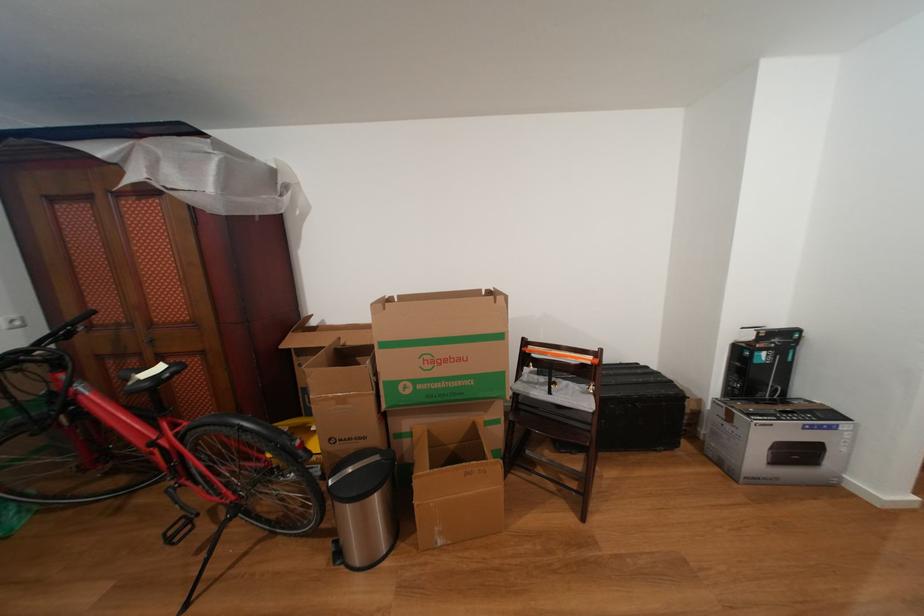
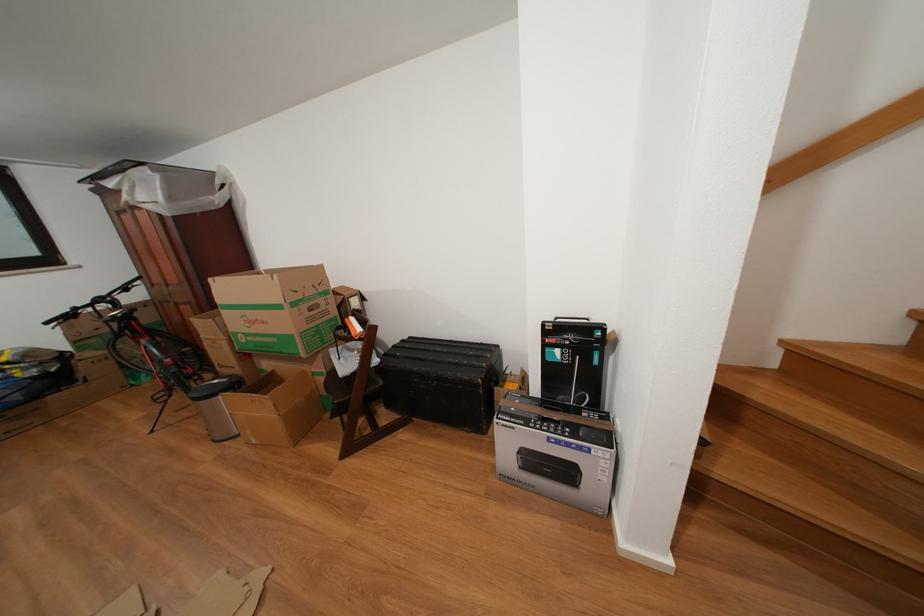
Question: I am providing you with two images of the same scene from different viewpoints. After the viewpoint changes to image2, which objects are now occluded?

Choices:
 (A) orange tape dispenser
 (B) open cardboard box
 (C) Canon printer box
 (D) none of these

Answer: (D)